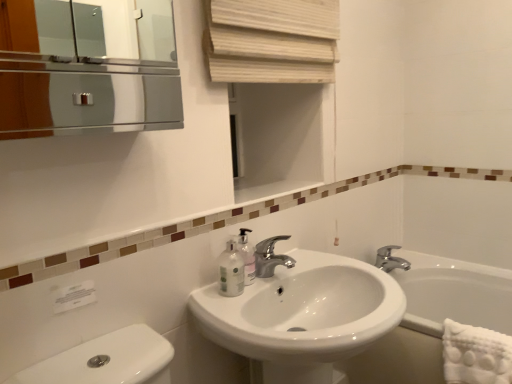
Identify the location of vacant area in front of polished chrome faucet at center, the 1th tap from the front. The image size is (512, 384). (245, 292).